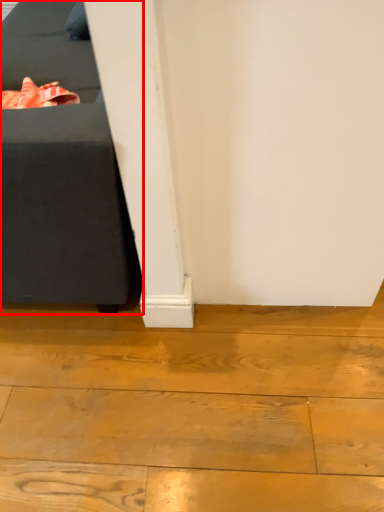
Question: From the image's perspective, where is furniture (annotated by the red box) located relative to wood?

Choices:
 (A) below
 (B) above

Answer: (B)